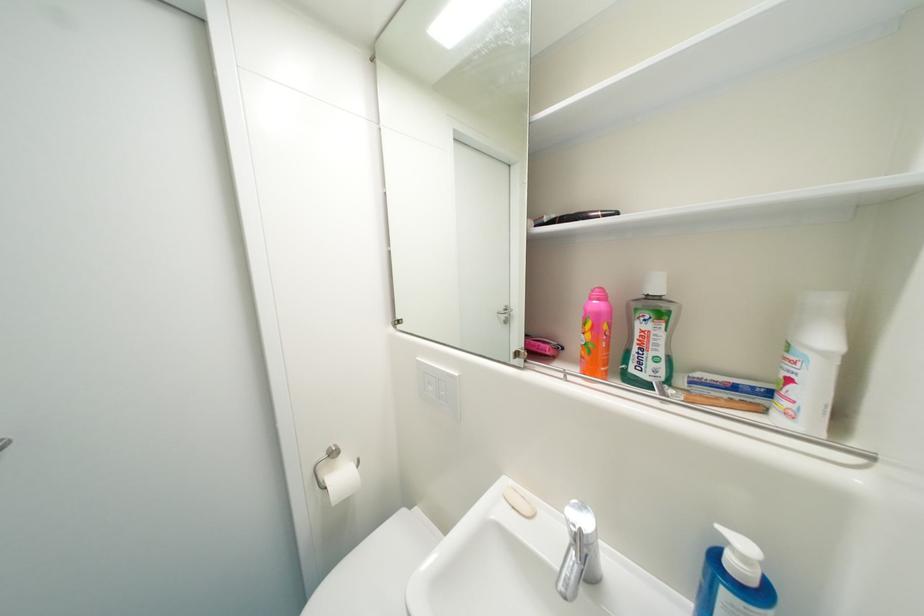
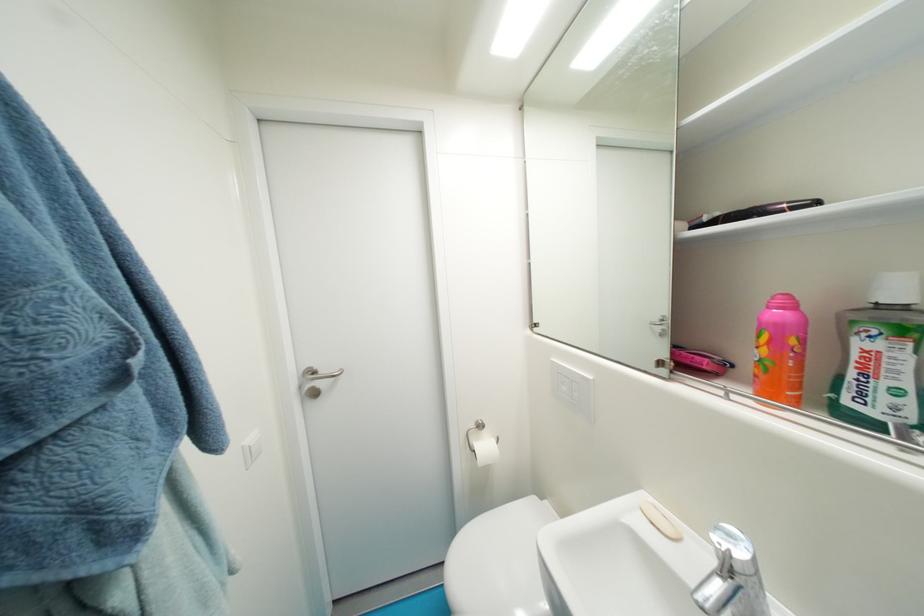
In the second image, find the point that corresponds to point (520, 509) in the first image.

(659, 525)